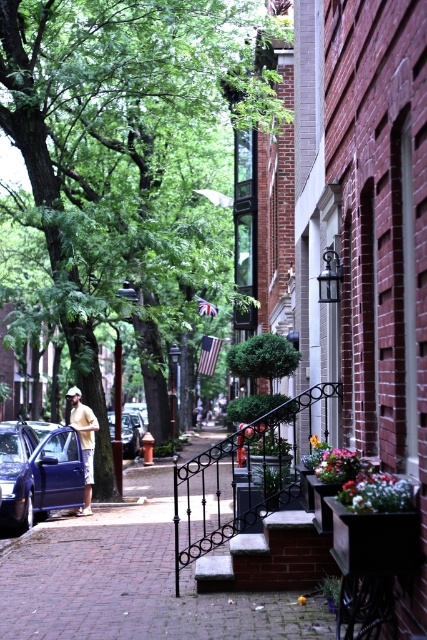
Is green leafy tree at upper left smaller than matte blue car at left?

Actually, green leafy tree at upper left might be larger than matte blue car at left.

From the picture: Does green leafy tree at upper left appear on the right side of matte blue car at left?

Indeed, green leafy tree at upper left is positioned on the right side of matte blue car at left.

Who is more distant from viewer, (170, 298) or (73, 461)?

The point (170, 298) is more distant.

At what (x,y) coordinates should I click in order to perform the action: click on green leafy tree at upper left. Please return your answer as a coordinate pair (x, y). Looking at the image, I should click on (123, 154).

How distant is green leafy tree at upper left from brick stairs at center?

green leafy tree at upper left and brick stairs at center are 10.50 meters apart from each other.

Which is below, green leafy tree at upper left or brick stairs at center?

brick stairs at center is lower down.

This screenshot has width=427, height=640. What are the coordinates of `green leafy tree at upper left` in the screenshot? It's located at (123, 154).

You are a GUI agent. You are given a task and a screenshot of the screen. Output one action in this format:
    pyautogui.click(x=<x>, y=<y>)
    Task: Click on the green leafy tree at upper left
    This screenshot has height=640, width=427.
    Given the screenshot: What is the action you would take?
    pyautogui.click(x=123, y=154)

Identify the location of light yellow shirt at center. The width and height of the screenshot is (427, 640). 84,442.

Where is `light yellow shirt at center`? light yellow shirt at center is located at coordinates (84, 442).